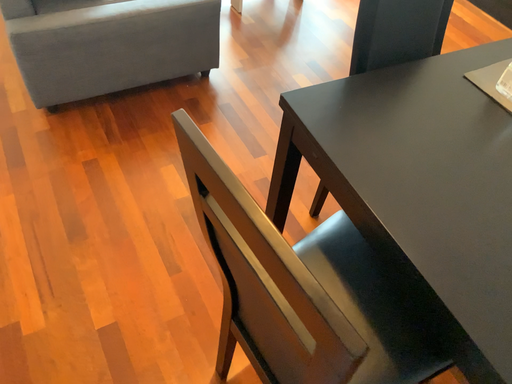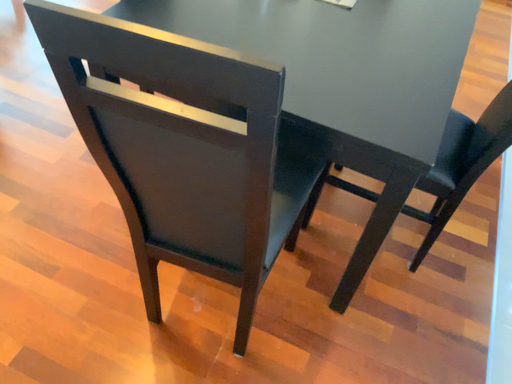
Question: How did the camera likely rotate when shooting the video?

Choices:
 (A) rotated left
 (B) rotated right

Answer: (B)